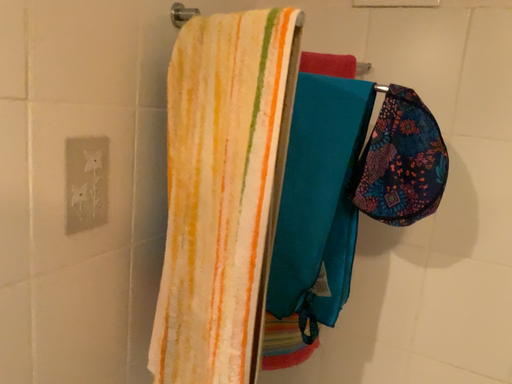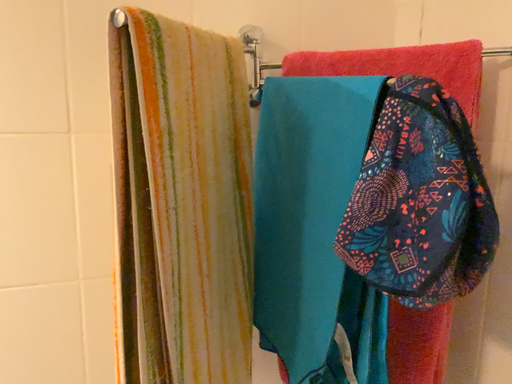
Question: Which way did the camera rotate in the video?

Choices:
 (A) rotated left
 (B) rotated right

Answer: (A)